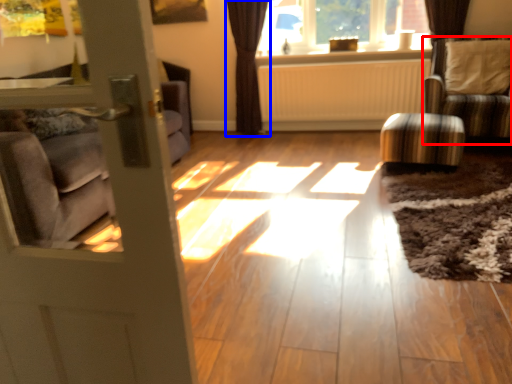
Question: Which of the following is the closest to the observer, chair (highlighted by a red box) or curtain (highlighted by a blue box)?

Choices:
 (A) chair
 (B) curtain

Answer: (A)